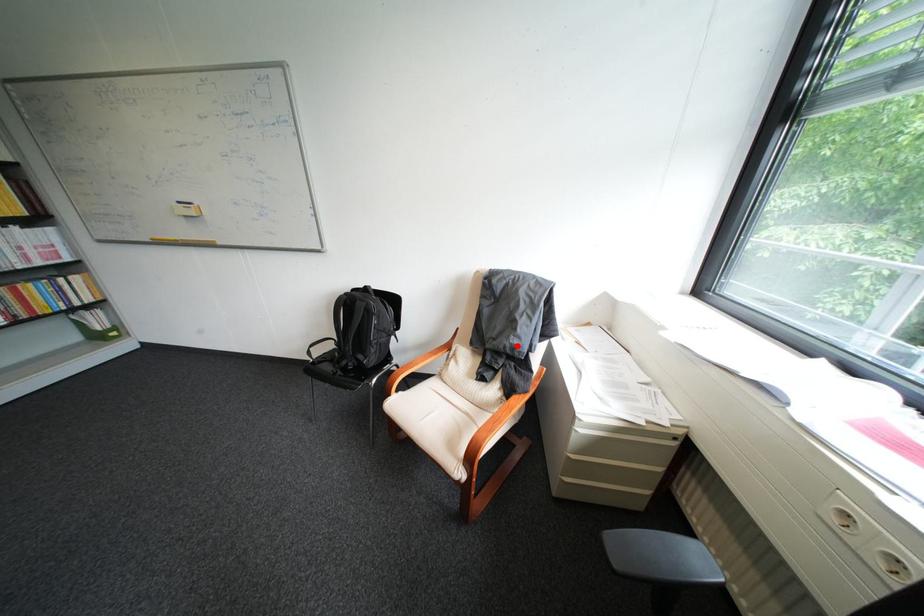
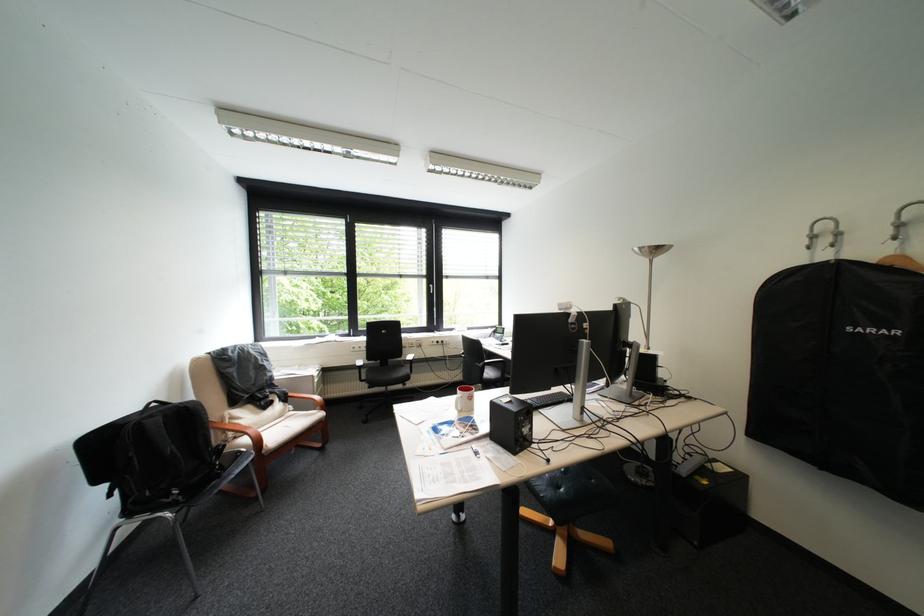
Question: I am providing you with two images of the same scene from different viewpoints. Given a red point in image1, look at the same physical point in image2. Is it:

Choices:
 (A) Closer to the viewpoint
 (B) Farther from the viewpoint

Answer: (A)